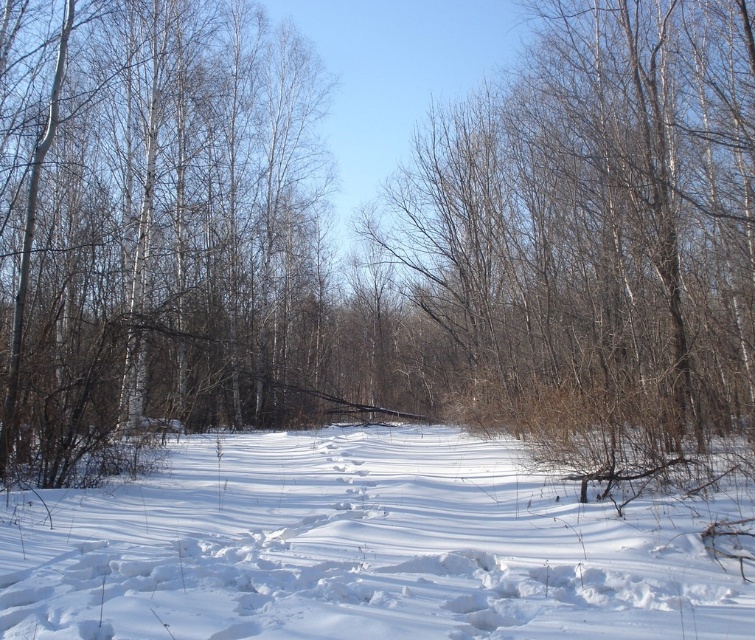
Question: Which point appears closest to the camera in this image?

Choices:
 (A) [x=635, y=236]
 (B) [x=704, y=572]
 (C) [x=185, y=273]

Answer: (B)

Question: Among these objects, which one is farthest from the camera?

Choices:
 (A) bare branches at center
 (B) white bark tree at center

Answer: (B)

Question: Does white bark tree at center have a larger size compared to white fluffy snow at center?

Choices:
 (A) yes
 (B) no

Answer: (A)

Question: Which point is farther to the camera?

Choices:
 (A) (407, 570)
 (B) (713, 394)
 (C) (279, 81)

Answer: (C)

Question: Can you confirm if white bark tree at center is positioned to the left of white fluffy snow at center?

Choices:
 (A) yes
 (B) no

Answer: (A)

Question: Does bare branches at center appear over white fluffy snow at center?

Choices:
 (A) yes
 (B) no

Answer: (A)